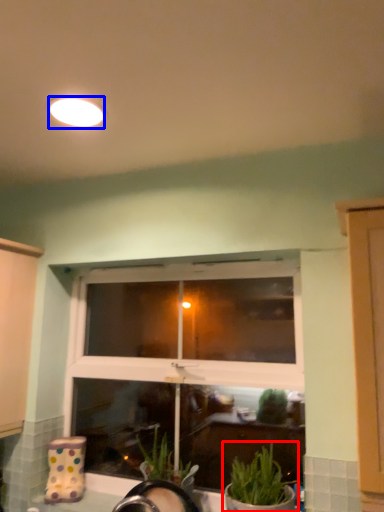
Question: Which of the following is the closest to the observer, houseplant (highlighted by a red box) or lighting (highlighted by a blue box)?

Choices:
 (A) houseplant
 (B) lighting

Answer: (B)